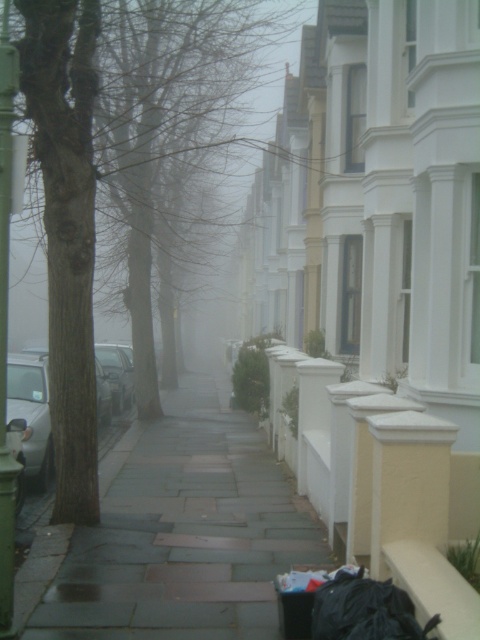
You are a pedestrian walking along the sidewalk and want to reach the dark gray stone pavement at center. Which direction should you move relative to the brown rough tree at left?

You should move to the right of the brown rough tree at left to reach the dark gray stone pavement at center.

You are a delivery person trying to navigate a narrow path between the dark gray stone pavement at center and the brown rough tree at left. Which object takes up more space in the scene?

The brown rough tree at left takes up more space in the scene than the dark gray stone pavement at center, as it is larger in size according to the description.

You are a pedestrian walking on the sidewalk and want to reach the brown rough tree at left. Can you see the tree from your current position on the dark gray stone pavement at center?

The brown rough tree at left is behind the dark gray stone pavement at center, so you cannot see it from your current position on the dark gray stone pavement at center.